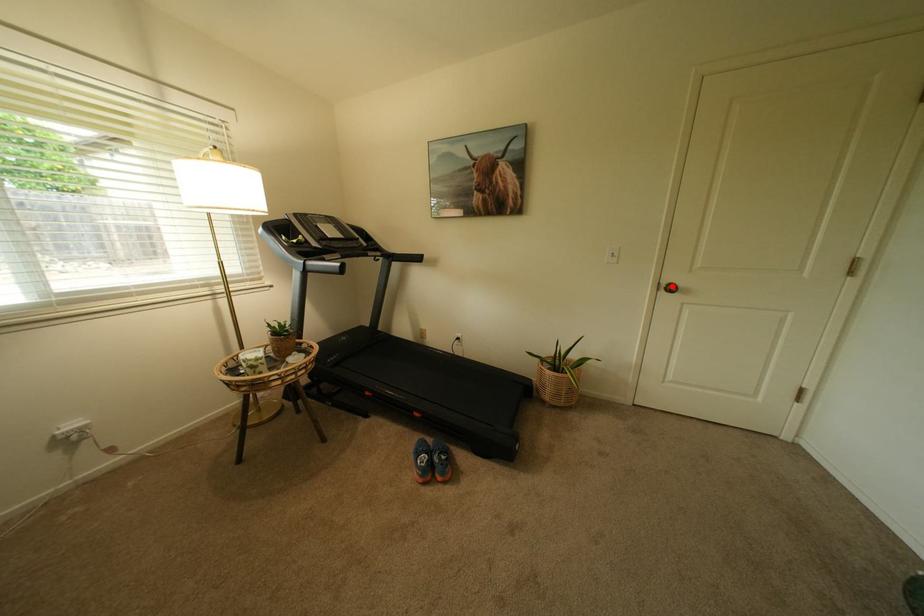
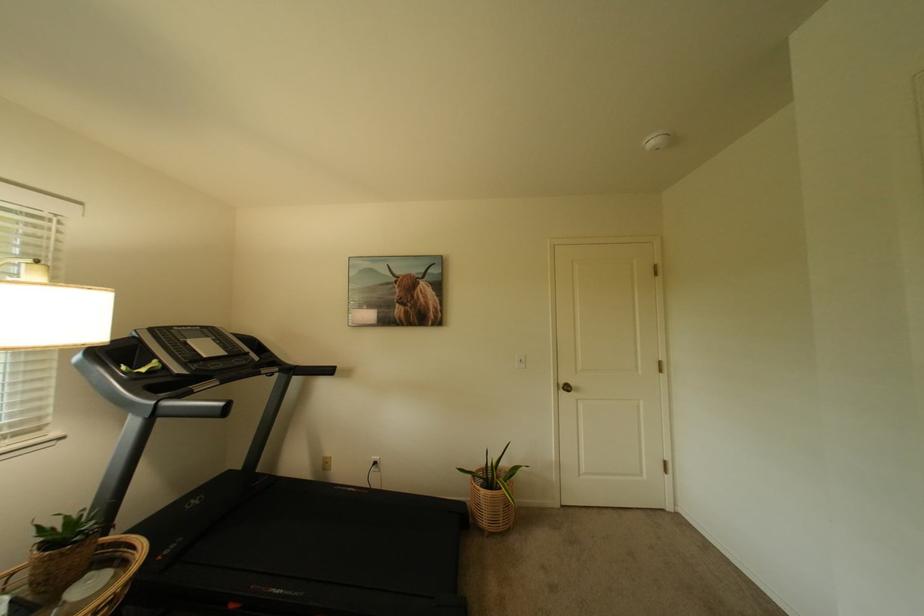
Where in the second image is the point corresponding to the highlighted location from the first image?

(569, 386)